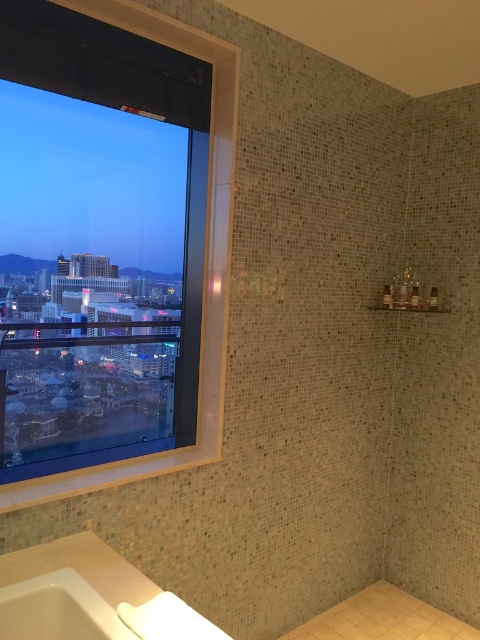
Between point (220, 307) and point (188, 637), which one is positioned behind?

The point (220, 307) is behind.

Does point (220, 323) lie in front of point (39, 545)?

No, (220, 323) is further to viewer.

Does point (72, 4) lie behind point (56, 624)?

That is True.

The image size is (480, 640). In order to click on transparent glass window at left in this screenshot , I will do `click(204, 264)`.